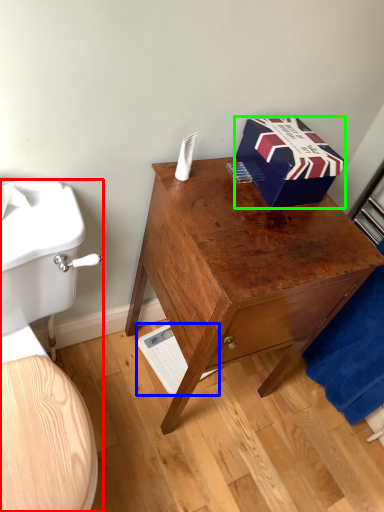
Question: Which is farther away from toilet (highlighted by a red box)? scale (highlighted by a blue box) or box (highlighted by a green box)?

Choices:
 (A) scale
 (B) box

Answer: (A)